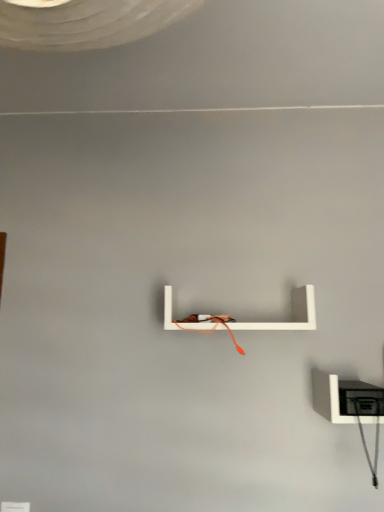
Question: Based on their positions, is white matte shelf at lower right, the 2th shelf from the top, located to the left or right of white matte shelf at center, the first shelf when ordered from top to bottom?

Choices:
 (A) right
 (B) left

Answer: (A)

Question: Does point (324, 389) appear closer or farther from the camera than point (256, 328)?

Choices:
 (A) farther
 (B) closer

Answer: (A)

Question: Do you think white matte shelf at lower right, marked as the first shelf in a right-to-left arrangement, is within white matte shelf at center, which appears as the second shelf when ordered from the bottom, or outside of it?

Choices:
 (A) inside
 (B) outside

Answer: (B)

Question: In terms of height, does white matte shelf at center, the first shelf when ordered from top to bottom, look taller or shorter compared to white matte shelf at lower right, which appears as the 2th shelf when viewed from the left?

Choices:
 (A) tall
 (B) short

Answer: (A)

Question: Based on their sizes in the image, would you say white matte shelf at center, the first shelf in the left-to-right sequence, is bigger or smaller than white matte shelf at lower right, the 2th shelf from the top?

Choices:
 (A) small
 (B) big

Answer: (B)

Question: Which is correct: white matte shelf at center, the second shelf when ordered from right to left, is inside white matte shelf at lower right, the 2th shelf from the top, or outside of it?

Choices:
 (A) inside
 (B) outside

Answer: (B)

Question: From the image's perspective, relative to white matte shelf at lower right, marked as the first shelf in a right-to-left arrangement, is white matte shelf at center, the first shelf when ordered from top to bottom, above or below?

Choices:
 (A) above
 (B) below

Answer: (A)